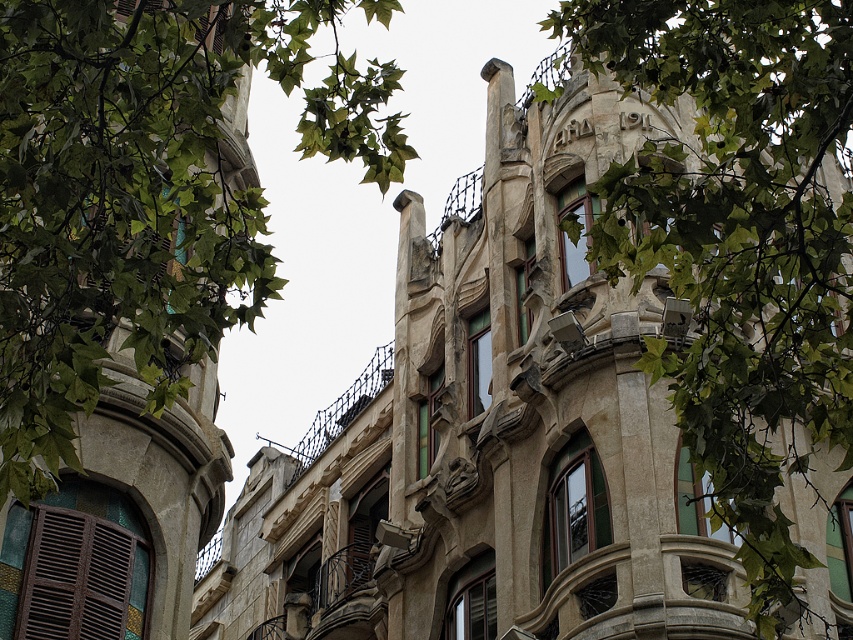
You are standing at the base of the building and looking up. There is a point marked at coordinates (144, 193) on the building facade. What does this point indicate?

The point at coordinates (144, 193) marks green leafy branches at upper left.

You are standing in front of the building and looking up at the green leafy branches at upper left and the green leafy branches at upper center. Which branch cluster is located more to the left?

The green leafy branches at upper left is positioned on the left side of green leafy branches at upper center, so the green leafy branches at upper left is more to the left.